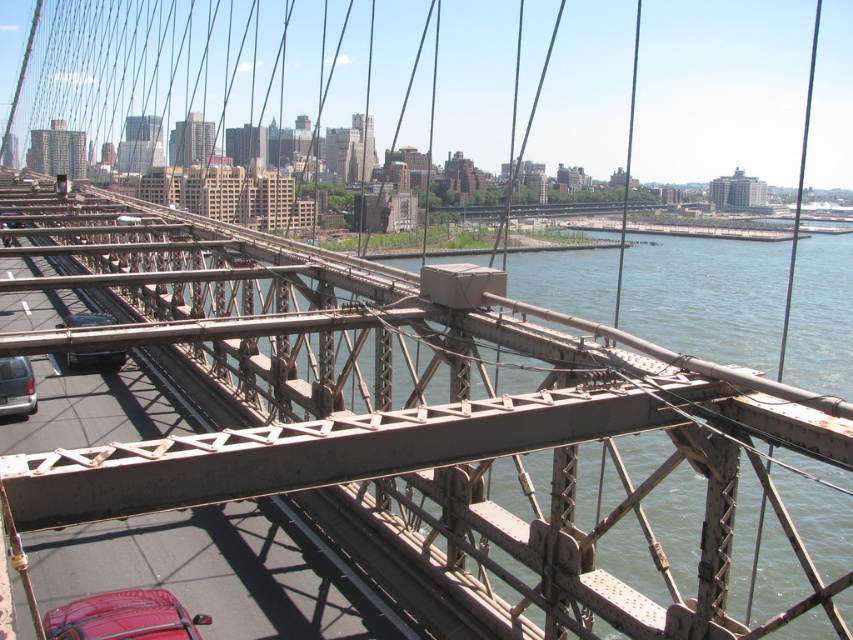
Question: Based on their relative distances, which object is farther from the matte black van at left?

Choices:
 (A) metallic red car at lower left
 (B) matte black car at lower left

Answer: (A)

Question: Which is nearer to the matte black van at left?

Choices:
 (A) metallic gray bridge at center
 (B) matte black car at lower left
 (C) metallic red car at lower left

Answer: (B)

Question: Which object is closer to the camera taking this photo?

Choices:
 (A) matte black car at lower left
 (B) matte black van at left

Answer: (A)

Question: Is matte black van at left smaller than matte black car at lower left?

Choices:
 (A) no
 (B) yes

Answer: (B)

Question: Is matte black van at left thinner than matte black car at lower left?

Choices:
 (A) yes
 (B) no

Answer: (A)

Question: Can you confirm if metallic gray bridge at center is smaller than metallic red car at lower left?

Choices:
 (A) yes
 (B) no

Answer: (B)